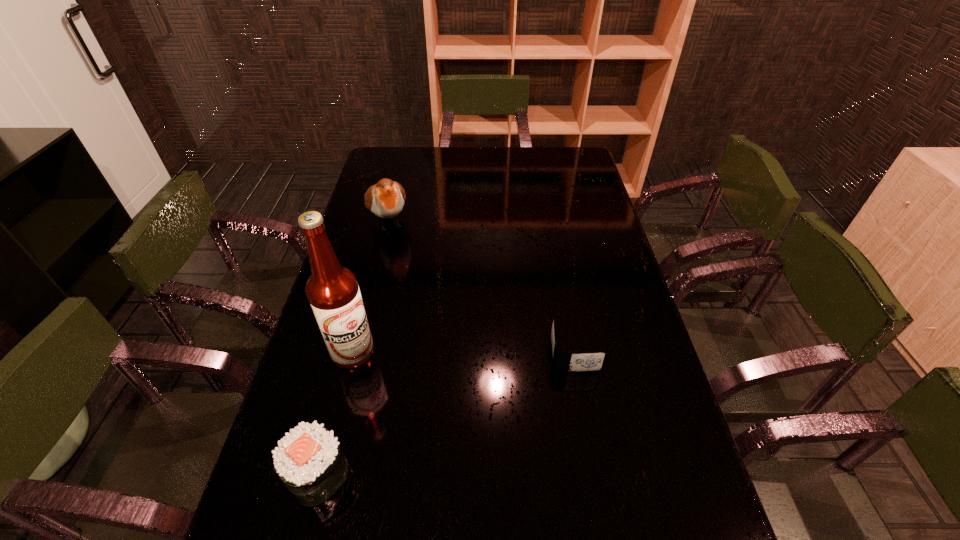
Locate an element on the screen. the nearest object is located at coordinates (309, 460).

Find the location of a particular element. This screenshot has height=540, width=960. sushi is located at coordinates (309, 460).

Locate an element on the screen. The width and height of the screenshot is (960, 540). the shortest object is located at coordinates (587, 360).

Where is `wallet`? This screenshot has height=540, width=960. wallet is located at coordinates tap(587, 360).

You are a GUI agent. You are given a task and a screenshot of the screen. Output one action in this format:
    pyautogui.click(x=<x>, y=<y>)
    Task: Click on the alcohol
    The width and height of the screenshot is (960, 540).
    Given the screenshot: What is the action you would take?
    (x=332, y=290)

The image size is (960, 540). I want to click on the farthest object, so click(x=385, y=199).

At what (x,y) coordinates should I click in order to perform the action: click on bird. Please return your answer as a coordinate pair (x, y). The height and width of the screenshot is (540, 960). Looking at the image, I should click on (385, 199).

Find the location of a particular element. vacant space located on the right of the nearest object is located at coordinates (531, 475).

This screenshot has height=540, width=960. In order to click on free location located 0.130m on the outer surface of the rightmost object in this screenshot , I will do `click(647, 354)`.

Identify the location of free spot located on the label side of the tallest object. The height and width of the screenshot is (540, 960). (444, 396).